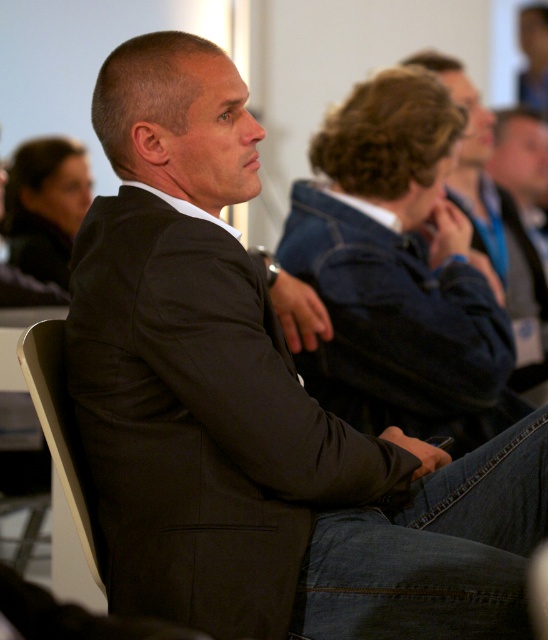
Question: Among these points, which one is nearest to the camera?

Choices:
 (A) (501, 198)
 (B) (448, 97)

Answer: (B)

Question: Is dark gray suit at center smaller than dark blue denim jacket at upper right?

Choices:
 (A) yes
 (B) no

Answer: (A)

Question: Is dark gray suit at center thinner than dark blue denim jacket at upper right?

Choices:
 (A) no
 (B) yes

Answer: (A)

Question: Which object appears closest to the camera in this image?

Choices:
 (A) dark gray suit at center
 (B) dark blue denim jacket at upper right

Answer: (A)

Question: Is dark gray suit at center in front of dark blue denim jacket at upper right?

Choices:
 (A) yes
 (B) no

Answer: (A)